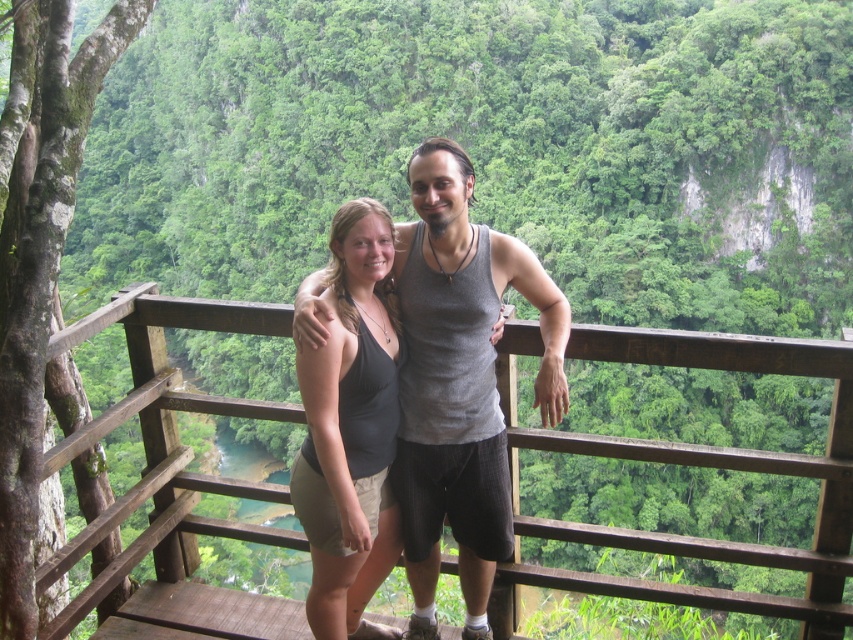
Measure the distance from wooden at center to black fabric tank top at center.

wooden at center is 2.34 meters away from black fabric tank top at center.

Does wooden at center come in front of black fabric tank top at center?

Yes, wooden at center is in front of black fabric tank top at center.

Which is in front, point (537, 435) or point (351, 525)?

Point (351, 525) is in front.

Find the location of a particular element. This screenshot has width=853, height=640. wooden at center is located at coordinates (701, 465).

Is wooden at center to the right of gray tank top at center from the viewer's perspective?

Yes, wooden at center is to the right of gray tank top at center.

Which of these two, wooden at center or gray tank top at center, stands taller?

Standing taller between the two is wooden at center.

Is point (846, 422) more distant than point (466, 609)?

That is False.

Identify the location of wooden at center. The width and height of the screenshot is (853, 640). (701, 465).

Which of these two, gray tank top at center or black fabric tank top at center, stands shorter?

black fabric tank top at center

Does gray tank top at center appear under black fabric tank top at center?

Incorrect, gray tank top at center is not positioned below black fabric tank top at center.

Does point (486, 324) come farther from viewer compared to point (370, 573)?

No, it is in front of (370, 573).

Where is `gray tank top at center`? The image size is (853, 640). gray tank top at center is located at coordinates (460, 381).